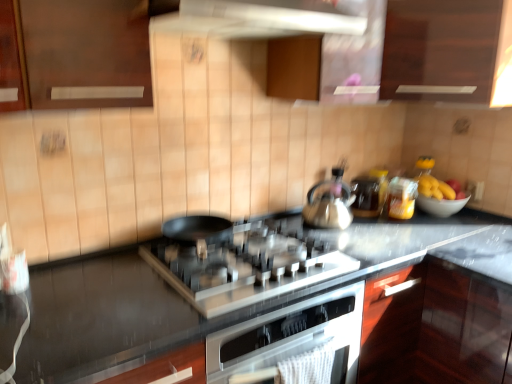
Question: Is white glossy bowl at right oriented towards wooden cabinet at upper center, the 1th cabinetry viewed from the left?

Choices:
 (A) no
 (B) yes

Answer: (A)

Question: Is white glossy bowl at right next to wooden cabinet at upper center, which is counted as the second cabinetry, starting from the right, and touching it?

Choices:
 (A) no
 (B) yes

Answer: (A)

Question: Considering the relative sizes of white glossy bowl at right and wooden cabinet at upper center, the 1th cabinetry viewed from the left, in the image provided, is white glossy bowl at right thinner than wooden cabinet at upper center, the 1th cabinetry viewed from the left,?

Choices:
 (A) no
 (B) yes

Answer: (B)

Question: From the image's perspective, is white glossy bowl at right above wooden cabinet at upper center, the 1th cabinetry viewed from the left?

Choices:
 (A) yes
 (B) no

Answer: (B)

Question: Is white glossy bowl at right at the right side of wooden cabinet at upper center, which is counted as the second cabinetry, starting from the right?

Choices:
 (A) no
 (B) yes

Answer: (B)

Question: From a real-world perspective, does white glossy bowl at right stand above wooden cabinet at upper center, the 1th cabinetry viewed from the left?

Choices:
 (A) no
 (B) yes

Answer: (A)

Question: Can you confirm if dark wood cabinet at upper center, acting as the 2th cabinetry starting from the left, is shorter than satin silver gas stove at center?

Choices:
 (A) yes
 (B) no

Answer: (B)

Question: Is dark wood cabinet at upper center, acting as the first cabinetry starting from the right, not close to satin silver gas stove at center?

Choices:
 (A) yes
 (B) no

Answer: (B)

Question: Are dark wood cabinet at upper center, acting as the 2th cabinetry starting from the left, and satin silver gas stove at center making contact?

Choices:
 (A) no
 (B) yes

Answer: (A)

Question: Is dark wood cabinet at upper center, acting as the 2th cabinetry starting from the left, further to the viewer compared to satin silver gas stove at center?

Choices:
 (A) no
 (B) yes

Answer: (B)

Question: Is dark wood cabinet at upper center, acting as the 2th cabinetry starting from the left, positioned in front of satin silver gas stove at center?

Choices:
 (A) no
 (B) yes

Answer: (A)

Question: Does dark wood cabinet at upper center, acting as the first cabinetry starting from the right, have a smaller size compared to satin silver gas stove at center?

Choices:
 (A) no
 (B) yes

Answer: (A)

Question: Would you say matte glass jar at center, acting as the first appliance starting from the left, is part of matte yellow jar at upper right, which is the first appliance in right-to-left order,'s contents?

Choices:
 (A) yes
 (B) no

Answer: (B)